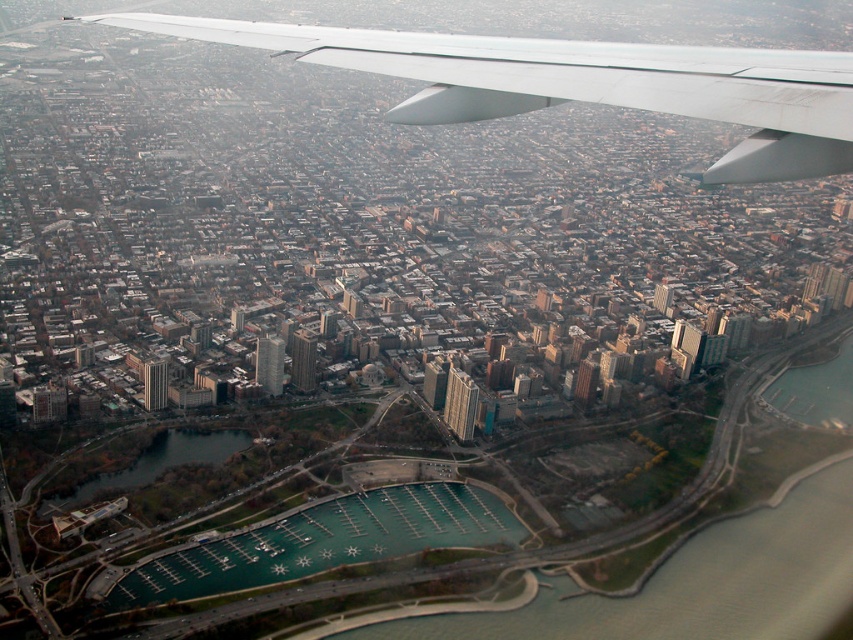
Between white matte wing at upper center and green water at lower left, which one is positioned higher?

white matte wing at upper center is above.

Which is more to the left, white matte wing at upper center or green water at lower left?

green water at lower left

Which is behind, point (521, 52) or point (131, 476)?

The point (131, 476) is more distant.

At what (x,y) coordinates should I click in order to perform the action: click on white matte wing at upper center. Please return your answer as a coordinate pair (x, y). Looking at the image, I should click on (581, 83).

Can you confirm if white matte wing at upper center is smaller than green water at lower center?

Incorrect, white matte wing at upper center is not smaller in size than green water at lower center.

Between white matte wing at upper center and green water at lower center, which one is positioned lower?

green water at lower center

Is point (805, 138) closer to camera compared to point (373, 540)?

Yes, point (805, 138) is in front of point (373, 540).

Find the location of a particular element. This screenshot has height=640, width=853. white matte wing at upper center is located at coordinates (581, 83).

Image resolution: width=853 pixels, height=640 pixels. What do you see at coordinates (325, 541) in the screenshot?
I see `green water at lower center` at bounding box center [325, 541].

Is point (386, 534) closer to viewer compared to point (39, 512)?

Yes, it is.

Image resolution: width=853 pixels, height=640 pixels. I want to click on green water at lower center, so (325, 541).